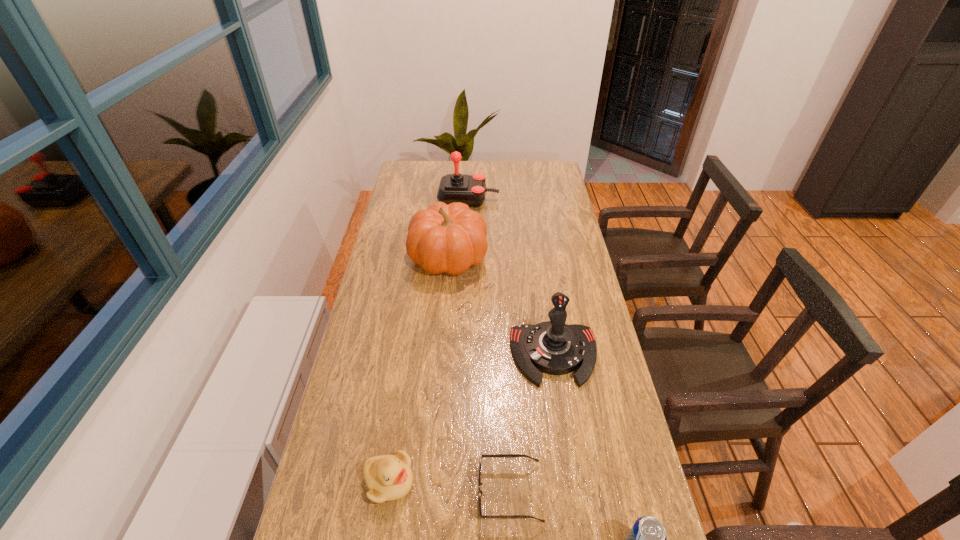
This screenshot has width=960, height=540. I want to click on free point located 0.210m on the beak of the duckling, so tap(504, 482).

Locate an element on the screen. Image resolution: width=960 pixels, height=540 pixels. vacant space located 0.210m at the front lenses of the shortest object is located at coordinates (388, 492).

This screenshot has width=960, height=540. I want to click on vacant position located at the front lenses of the shortest object, so click(444, 492).

You are a GUI agent. You are given a task and a screenshot of the screen. Output one action in this format:
    pyautogui.click(x=<x>, y=<y>)
    Task: Click on the vacant position located at the front lenses of the shortest object
    This screenshot has height=540, width=960.
    Given the screenshot: What is the action you would take?
    pyautogui.click(x=388, y=492)

I want to click on pumpkin located in the left edge section of the desktop, so click(x=443, y=238).

The image size is (960, 540). What are the coordinates of `duckling located in the left edge section of the desktop` in the screenshot? It's located at (388, 477).

This screenshot has height=540, width=960. I want to click on object that is at the right edge, so click(x=552, y=347).

The width and height of the screenshot is (960, 540). Find the location of `free space at the far edge`. free space at the far edge is located at coordinates click(x=439, y=173).

Find the location of `vacant space at the left edge of the desktop`. vacant space at the left edge of the desktop is located at coordinates (347, 407).

Find the location of a particular element. vacant space at the right edge of the desktop is located at coordinates 575,256.